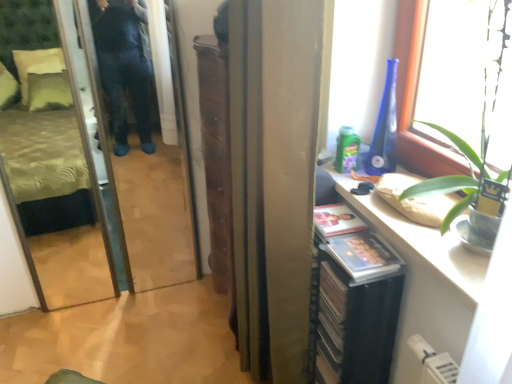
Question: From a real-world perspective, is transparent glass screen door at left positioned above or below satin gold curtain at center?

Choices:
 (A) below
 (B) above

Answer: (A)

Question: In terms of height, does transparent glass screen door at left look taller or shorter compared to satin gold curtain at center?

Choices:
 (A) short
 (B) tall

Answer: (B)

Question: Which of these objects is positioned closest to the transparent glass window at upper right?

Choices:
 (A) transparent glass screen door at left
 (B) satin gold curtain at center

Answer: (B)

Question: Based on their relative distances, which object is nearer to the satin gold curtain at center?

Choices:
 (A) transparent glass screen door at left
 (B) transparent glass window at upper right

Answer: (B)